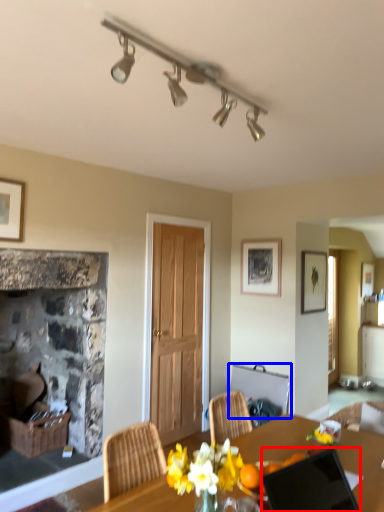
Question: Which object appears closest to the camera in this image, laptop (highlighted by a red box) or chair (highlighted by a blue box)?

Choices:
 (A) laptop
 (B) chair

Answer: (A)